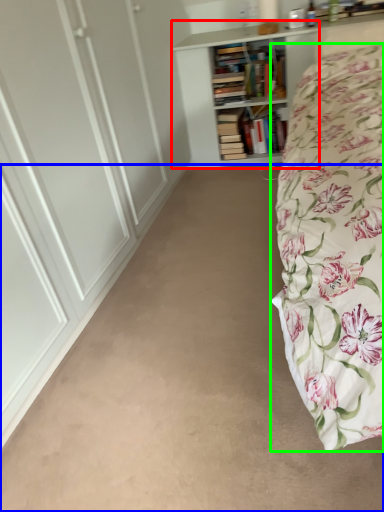
Question: Which object is positioned closest to bookcase (highlighted by a red box)? Select from plain (highlighted by a blue box) and bed (highlighted by a green box).

Choices:
 (A) plain
 (B) bed

Answer: (B)